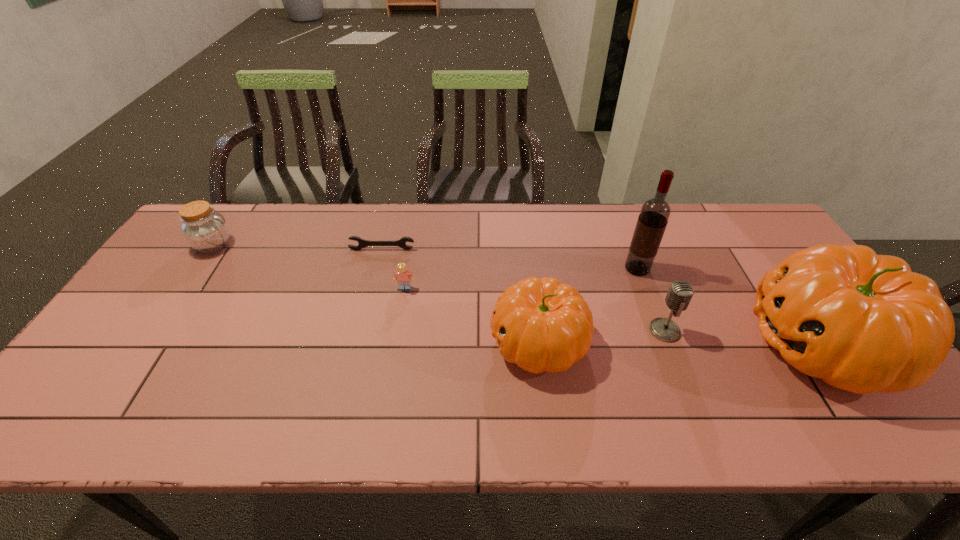
Find the location of a particular element. The image size is (960, 540). free space located on the open ends of the shortest object is located at coordinates (377, 268).

This screenshot has width=960, height=540. Identify the location of vacant area situated on the front of the microphone. (686, 387).

In order to click on jar at the far edge in this screenshot , I will do `click(204, 229)`.

Where is `wrench located in the far edge section of the desktop`? The height and width of the screenshot is (540, 960). wrench located in the far edge section of the desktop is located at coordinates [x=362, y=243].

This screenshot has width=960, height=540. I want to click on object at the left edge, so click(x=204, y=229).

I want to click on object at the right edge, so click(864, 323).

Find the location of a particular element. The width and height of the screenshot is (960, 540). object positioned at the far left corner is located at coordinates (204, 229).

Image resolution: width=960 pixels, height=540 pixels. Identify the location of object located in the near right corner section of the desktop. (864, 323).

This screenshot has width=960, height=540. In order to click on blank space at the far edge in this screenshot , I will do `click(520, 215)`.

In the image, there is a desktop. Where is `free space at the near edge`? Image resolution: width=960 pixels, height=540 pixels. free space at the near edge is located at coordinates (530, 378).